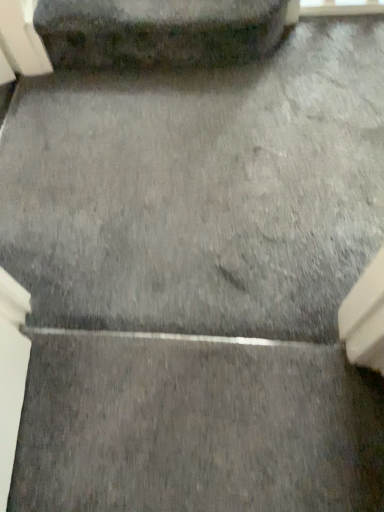
In order to face dark gray stone at upper center, should I rotate leftwards or rightwards?

Rotate your view left by about 2.817°.

In order to click on dark gray stone at upper center in this screenshot , I will do `click(158, 31)`.

This screenshot has width=384, height=512. What do you see at coordinates (158, 31) in the screenshot? I see `dark gray stone at upper center` at bounding box center [158, 31].

You are a GUI agent. You are given a task and a screenshot of the screen. Output one action in this format:
    pyautogui.click(x=<x>, y=<y>)
    Task: Click on the dark gray stone at upper center
    The image size is (384, 512).
    Given the screenshot: What is the action you would take?
    pyautogui.click(x=158, y=31)